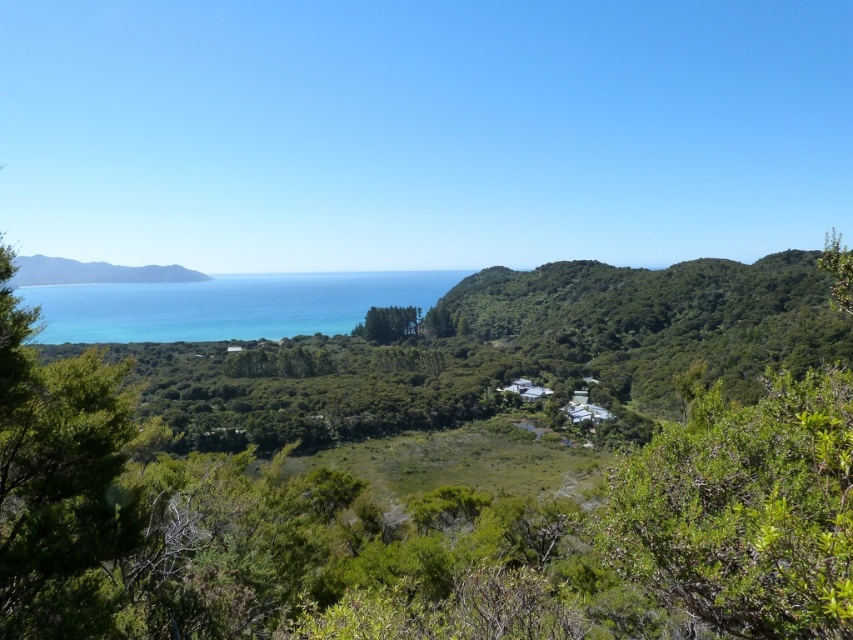
Question: Which object is closer to the camera taking this photo?

Choices:
 (A) green leafy bush at center-right
 (B) green leafy tree at center

Answer: (A)

Question: Does green leafy bush at center-right come in front of green grassy hillside at left?

Choices:
 (A) no
 (B) yes

Answer: (B)

Question: Is green leafy bush at center-right smaller than green grassy hillside at left?

Choices:
 (A) no
 (B) yes

Answer: (B)

Question: Which point is farther to the camera?

Choices:
 (A) 706,394
 (B) 51,278
 (C) 398,294
 (D) 361,330

Answer: (B)

Question: Based on their relative distances, which object is farther from the green leafy tree at center?

Choices:
 (A) green grassy hillside at left
 (B) green leafy bush at center-right
 (C) blue water at center

Answer: (B)

Question: Is green leafy bush at center-right closer to camera compared to blue water at center?

Choices:
 (A) yes
 (B) no

Answer: (A)